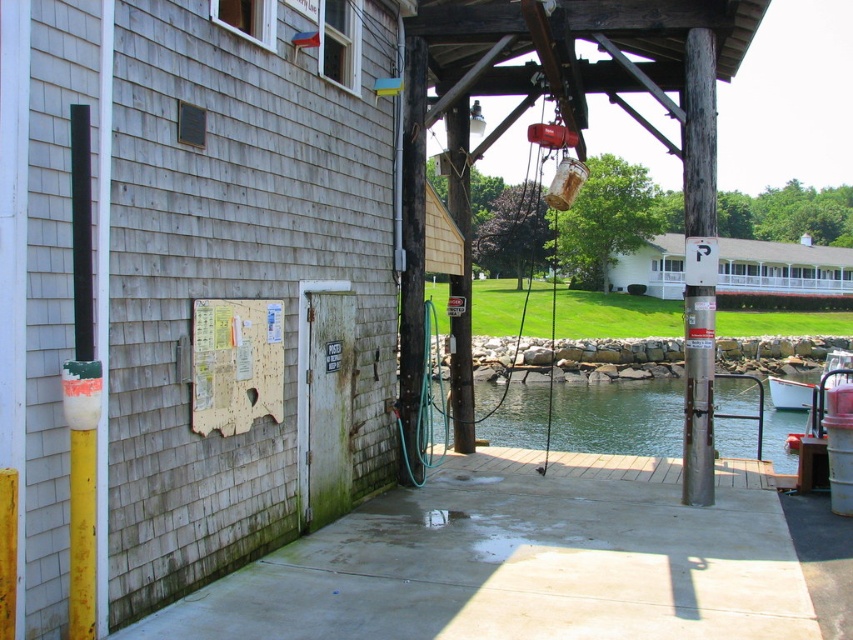
Does point (584, 449) come behind point (700, 102)?

Yes.

Which is more to the right, green water at dock center or wooden post at right?

wooden post at right

What do you see at coordinates (618, 417) in the screenshot?
I see `green water at dock center` at bounding box center [618, 417].

Image resolution: width=853 pixels, height=640 pixels. I want to click on green water at dock center, so click(618, 417).

Based on the photo, which is more to the right, concrete at center or white plastic boat at lower right?

white plastic boat at lower right

How much distance is there between concrete at center and white plastic boat at lower right?

14.10 meters

The height and width of the screenshot is (640, 853). I want to click on concrete at center, so click(x=523, y=561).

Who is taller, white wooden porch at upper center or white plastic boat at lower right?

white wooden porch at upper center

Identify the location of white wooden porch at upper center. This screenshot has height=640, width=853. (788, 282).

This screenshot has width=853, height=640. Identify the location of white wooden porch at upper center. (788, 282).